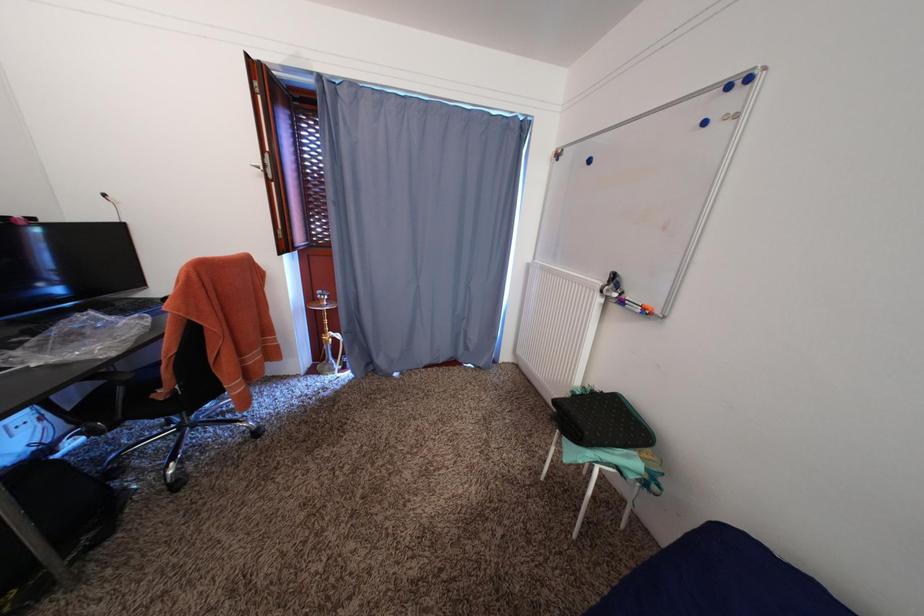
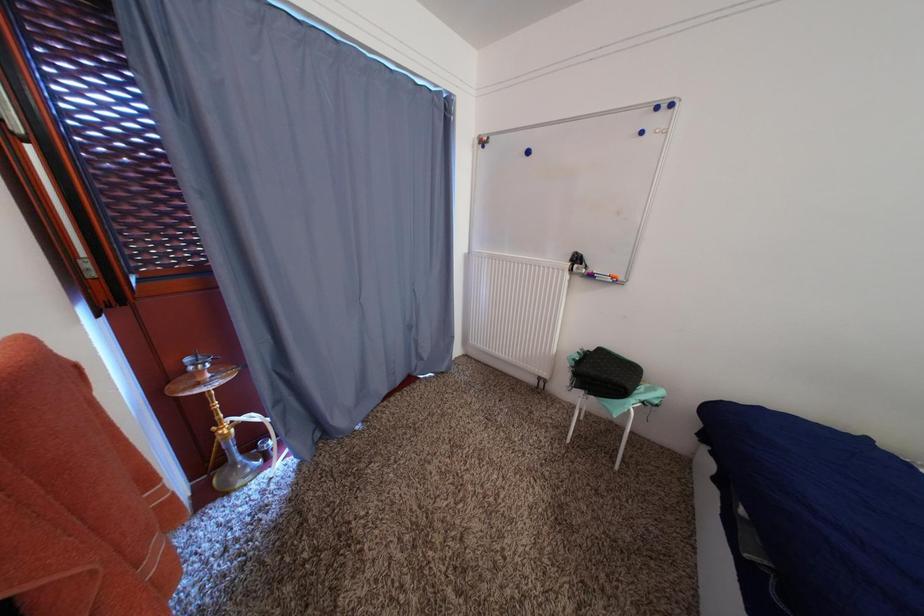
Question: The images are taken continuously from a first-person perspective. In which direction is your viewpoint rotating?

Choices:
 (A) Left
 (B) Right
 (C) Up
 (D) Down

Answer: (B)